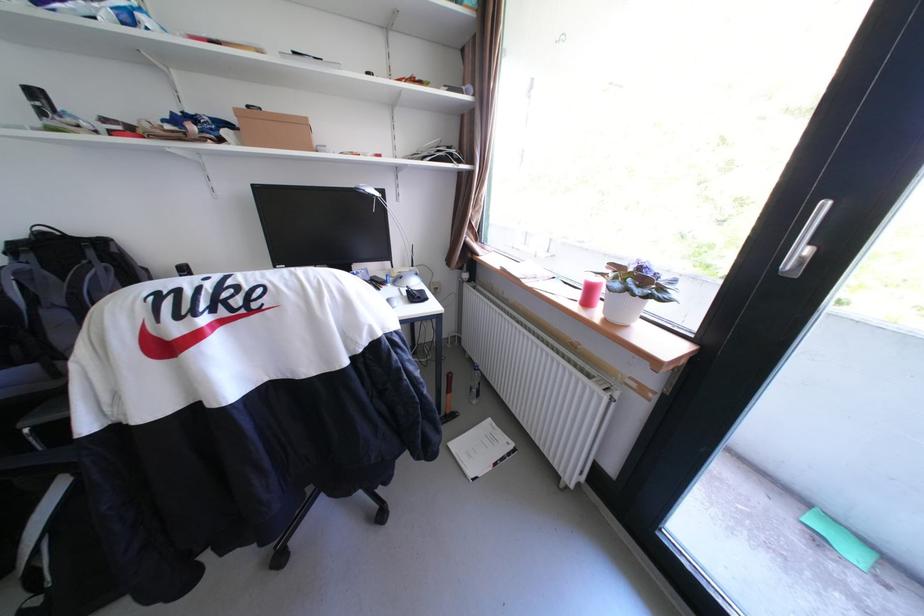
The image size is (924, 616). What are the coordinates of `silver door handle` in the screenshot? It's located at (804, 243).